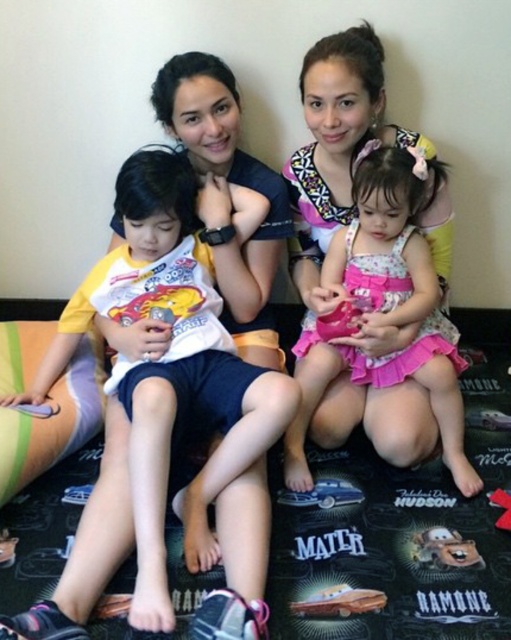
Question: Which of the following is the farthest from the observer?

Choices:
 (A) (153, 184)
 (B) (303, 612)
 (C) (425, 314)
 (D) (449, 554)

Answer: (C)

Question: Which is farther from the brown plush toy at lower right?

Choices:
 (A) metallic gold car at lower center
 (B) rubber red toy at lower right
 (C) pink satin dress at center

Answer: (C)

Question: Which of the following is the closest to the observer?

Choices:
 (A) pink satin dress at center
 (B) white cotton shirt at center
 (C) metallic blue car at lower center
 (D) brown plush toy at lower right

Answer: (B)

Question: Is metallic gold car at lower center below rubber red toy at lower right?

Choices:
 (A) no
 (B) yes

Answer: (B)

Question: In this image, where is white cotton shirt at center located relative to brown plush toy at lower right?

Choices:
 (A) below
 (B) above

Answer: (B)

Question: Does pink satin dress at center have a greater width compared to brown plush toy at lower right?

Choices:
 (A) yes
 (B) no

Answer: (A)